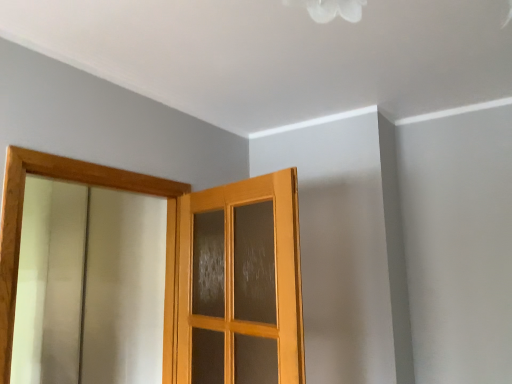
Find the location of a particular element. This screenshot has width=512, height=384. matte wooden door at center is located at coordinates (239, 284).

Measure the distance between matte wooden door at center and camera.

matte wooden door at center and camera are 1.73 meters apart from each other.

This screenshot has height=384, width=512. Describe the element at coordinates (239, 284) in the screenshot. I see `matte wooden door at center` at that location.

Where is `matte wooden door at center`? matte wooden door at center is located at coordinates (239, 284).